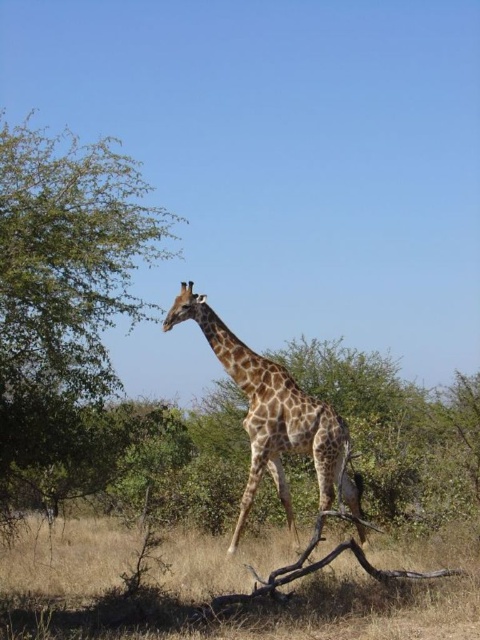
You are a small animal trying to cross from the green leafy tree at upper left to the dry grass at lower center. The distance between them is crucial for your jump. Can you make the jump if your maximum jump distance is 3 meters?

The green leafy tree at upper left is 3.22 meters from the dry grass at lower center. Since your maximum jump distance is 3 meters, you cannot make the jump as the distance is slightly longer than your capability.